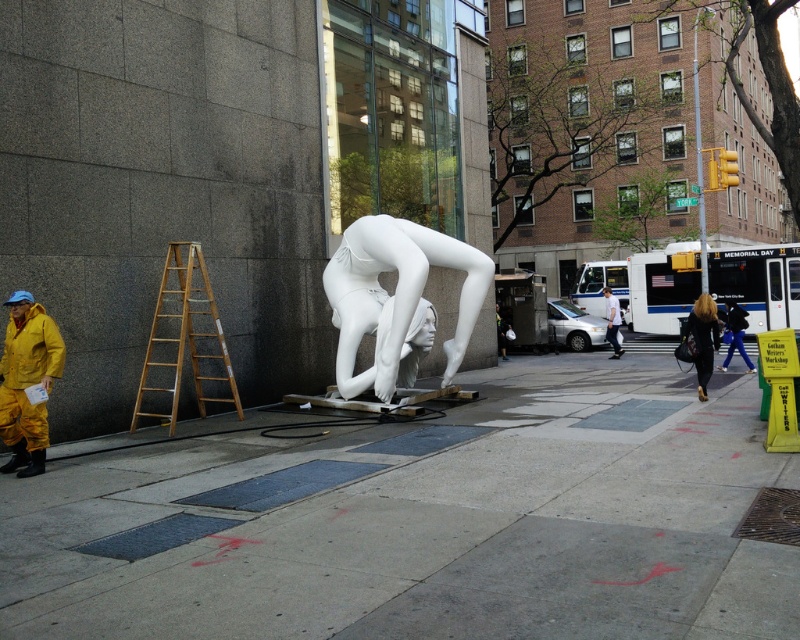
Question: Estimate the real-world distances between objects in this image. Which object is farther from the wooden ladder at left?

Choices:
 (A) gray concrete sidewalk at center
 (B) white matte mannequin at center
 (C) yellow matte jacket at lower left
 (D) white glossy sculpture at center

Answer: (B)

Question: In this image, where is yellow matte jacket at lower left located relative to white matte mannequin at center?

Choices:
 (A) left
 (B) right

Answer: (A)

Question: Which object is farther from the camera taking this photo?

Choices:
 (A) wooden ladder at left
 (B) black leather jacket at center

Answer: (B)

Question: Is yellow matte jacket at lower left to the left of black leather jacket at center from the viewer's perspective?

Choices:
 (A) no
 (B) yes

Answer: (B)

Question: Among these objects, which one is nearest to the camera?

Choices:
 (A) white glossy sculpture at center
 (B) white matte mannequin at center
 (C) wooden ladder at left
 (D) black leather jacket at center

Answer: (C)

Question: Is white glossy sculpture at center to the right of wooden ladder at left from the viewer's perspective?

Choices:
 (A) no
 (B) yes

Answer: (B)